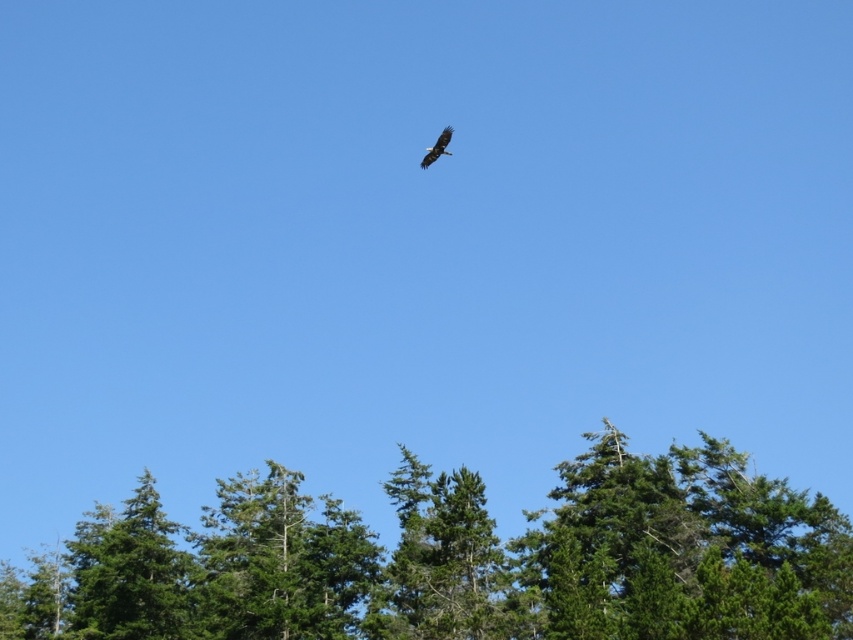
You are a park ranger observing the scene from a lookout point. You need to determine if a drone with a 100 meter range can capture both the green textured tree at center and the dark brown eagle at upper center in the same photo. Can it?

The distance between the green textured tree at center and the dark brown eagle at upper center is 34.38 meters. Since the drone has a 100 meter range, it can easily capture both objects within its range.

You are a hiker standing at the base of the green textured tree at center. You look up and see the dark brown eagle at upper center flying above. Based on the scene, can you determine if the eagle is flying above the tree or somewhere else?

The green textured tree at center is located below the dark brown eagle at upper center, so the eagle is flying above the tree.

You are a birdwatcher observing the scene. You notice the green textured tree at center and the dark brown eagle at upper center. Which object is positioned more to the right side of the image?

The dark brown eagle at upper center is positioned more to the right side of the image than the green textured tree at center.